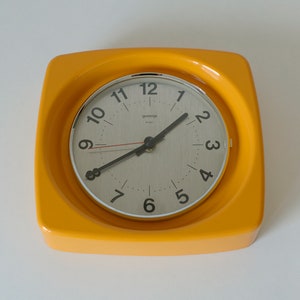
The width and height of the screenshot is (300, 300). I want to click on wall to the right of clock, so click(x=278, y=136).